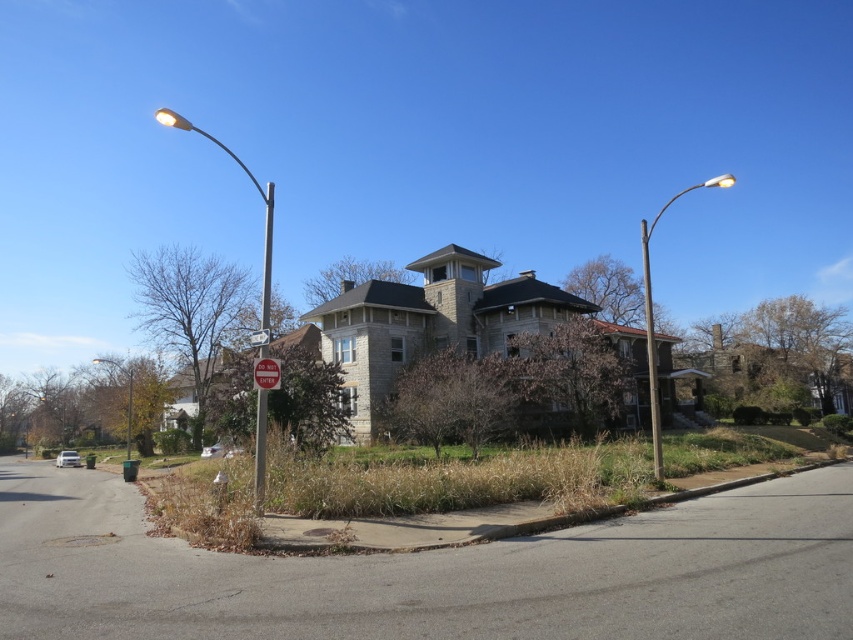
You are standing at the street corner and notice a metallic pole at right. Can you determine its exact location based on the coordinate system provided?

The metallic pole at right is located at point (651, 353).

You are standing at the street corner and see two points in the scene. Which point is closer to you, point (263, 195) or point (251, 337)?

Point (251, 337) is closer to you because it is less further to the camera than point (263, 195).

You are standing at the street corner with two streetlights. You see a point marked at coordinates (x=265, y=372). What object is located at that point?

The point at (x=265, y=372) indicates a red painted metal sign at center.